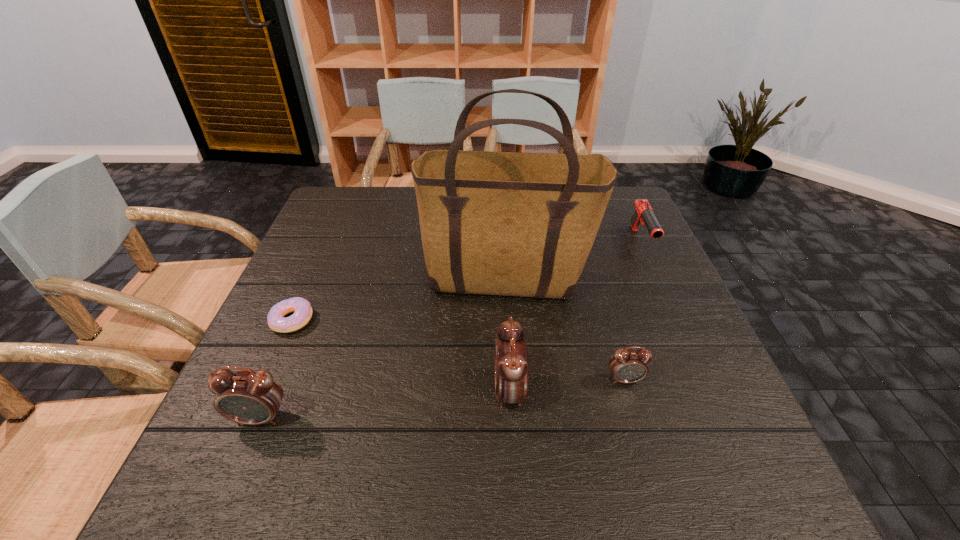
Where is `free space between the shortest object and the second alarm clock from left to right`? The height and width of the screenshot is (540, 960). free space between the shortest object and the second alarm clock from left to right is located at coordinates (400, 356).

Locate an element on the screen. The image size is (960, 540). free spot between the gun and the second alarm clock from left to right is located at coordinates (575, 316).

The height and width of the screenshot is (540, 960). In order to click on vacant space that is in between the fourth shortest object and the tallest object in this screenshot , I will do `click(384, 350)`.

At what (x,y) coordinates should I click in order to perform the action: click on empty space between the doughnut and the second alarm clock from left to right. Please return your answer as a coordinate pair (x, y). Image resolution: width=960 pixels, height=540 pixels. Looking at the image, I should click on [x=400, y=356].

The height and width of the screenshot is (540, 960). In order to click on vacant space that's between the second shortest alarm clock and the second alarm clock from right to left in this screenshot , I will do (385, 404).

Where is `empty space between the second alarm clock from right to left and the shortest object`? This screenshot has height=540, width=960. empty space between the second alarm clock from right to left and the shortest object is located at coordinates (400, 356).

Identify the location of free space that is in between the shortest alarm clock and the doughnut. (458, 350).

Find the location of a particular element. object that is the second closest to the leftmost alarm clock is located at coordinates (519, 224).

You are a GUI agent. You are given a task and a screenshot of the screen. Output one action in this format:
    pyautogui.click(x=<x>, y=<y>)
    Task: Click on the closest object to the rightmost alarm clock
    Image resolution: width=960 pixels, height=540 pixels.
    Given the screenshot: What is the action you would take?
    pyautogui.click(x=511, y=356)

Select which alarm clock appears as the second closest to the gun. Please provide its 2D coordinates. Your answer should be formatted as a tuple, i.e. [(x, y)], where the tuple contains the x and y coordinates of a point satisfying the conditions above.

[(511, 356)]